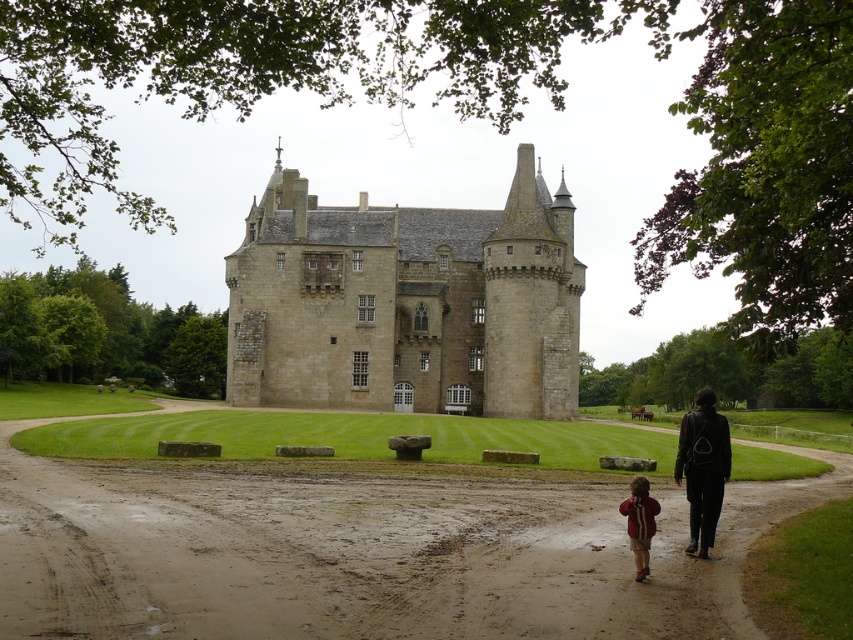
Based on the photo, you are a photographer standing on the muddy path leading to the castle. You see two jackets, the black leather jacket at lower right and the red fleece jacket at lower right. Which jacket is positioned more to the right?

The black leather jacket at lower right is positioned more to the right than the red fleece jacket at lower right.

You are a tour guide leading visitors to the castle. Two jackets are visible on the muddy path leading to the castle. The black leather jacket at lower right and the red fleece jacket at lower right. Which jacket is farther away from the other?

The distance between the black leather jacket at lower right and the red fleece jacket at lower right is 22.61 feet, so the jackets are separated by that distance. However, the question asks which is farther from the other, but since distance is mutual, both are equally distant from each other. However, if considering their positions along the path, since they are both at lower right, perhaps one is ahead of the other along the path. Wait, the objects description only states the distance between them, not a